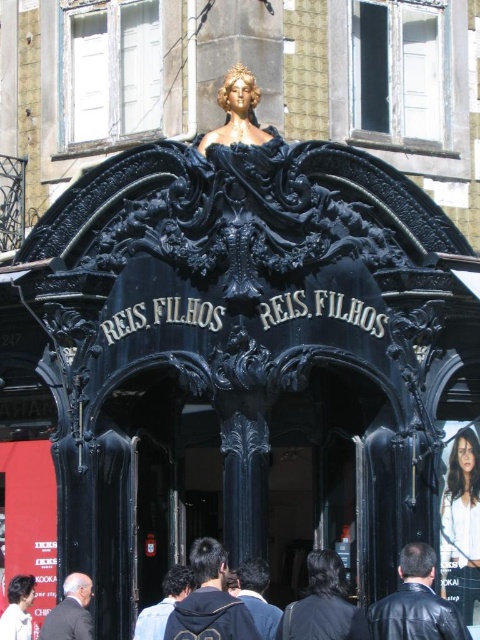
Question: Which point is closer to the camera?

Choices:
 (A) [82, 605]
 (B) [149, 625]
 (C) [232, 88]

Answer: (B)

Question: Which point appears closest to the camera in this image?

Choices:
 (A) (414, 545)
 (B) (190, 573)
 (C) (16, 625)

Answer: (A)

Question: Which is farther from the black leather jacket at center?

Choices:
 (A) smooth black hair at center
 (B) dark gray suit at lower left
 (C) dark blue fabric at lower center
 (D) dark blue jacket at center

Answer: (A)

Question: Does black leather jacket at center lie in front of dark blue jacket at center?

Choices:
 (A) no
 (B) yes

Answer: (B)

Question: Is black leather jacket at center to the right of dark brown leather jacket at center from the viewer's perspective?

Choices:
 (A) yes
 (B) no

Answer: (B)

Question: Does gold-painted statue at upper center appear under dark gray suit at lower left?

Choices:
 (A) no
 (B) yes

Answer: (A)